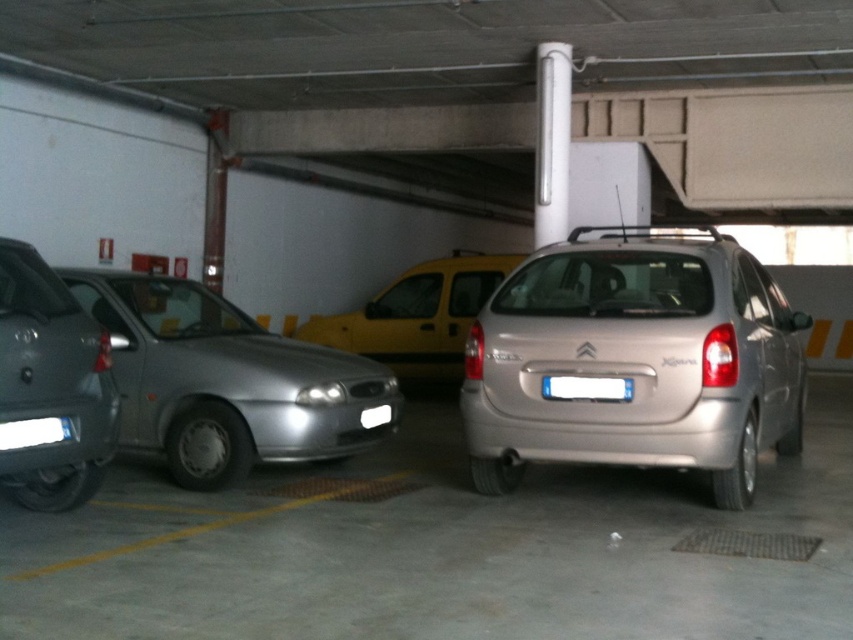
You are standing at the entrance of the parking garage and want to locate the satin gold hatchback at center. According to the coordinates provided, where should you look to find it?

The satin gold hatchback at center is located at the coordinates point (636, 360), so you should look towards the central area of the garage, slightly towards the right side to find it.

Consider the image. You are a delivery driver trying to park your 1.8 meters wide truck in this garage. You see the satin gold hatchback at center and the silver metallic hatchback at left. Which parking space between these two vehicles can accommodate your truck?

The satin gold hatchback at center has a larger width than the silver metallic hatchback at left, so the parking space between them can accommodate your 1.8 meters wide truck.

You are a delivery driver trying to park your vehicle in this garage. You have a truck that is 2 meters wide. The satin gold hatchback at center and the yellow matte van at center are already parked. Can your truck fit between them if you align it with the yellow lines on the floor?

The satin gold hatchback at center is wider than the yellow matte van at center. Since your truck is 2 meters wide, you need to check the space between them. However, without knowing the exact distance between the vehicles, it is impossible to determine if the truck will fit. Please measure the space before attempting to park.